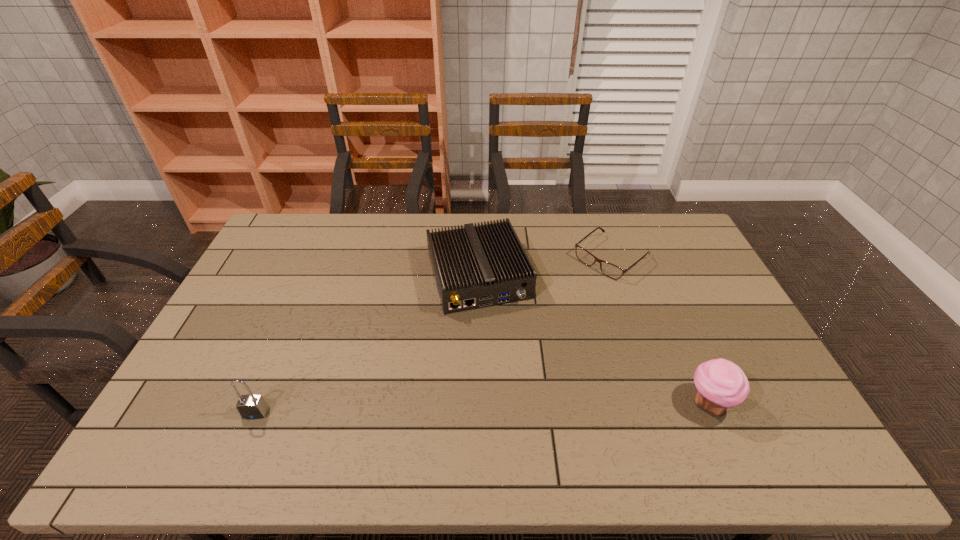
Find the location of `free spot at the left edge of the desktop`. free spot at the left edge of the desktop is located at coordinates (249, 341).

Identify the location of free space between the second object from left to right and the shortest object. (x=545, y=267).

You are a GUI agent. You are given a task and a screenshot of the screen. Output one action in this format:
    pyautogui.click(x=<x>, y=<y>)
    Task: Click on the empty location between the spectacles and the leftmost object
    The image size is (960, 540).
    Given the screenshot: What is the action you would take?
    pyautogui.click(x=434, y=335)

Where is `free point between the second object from left to right and the shortest object`? This screenshot has width=960, height=540. free point between the second object from left to right and the shortest object is located at coordinates (545, 267).

Identify the location of free space between the shortest object and the router. The width and height of the screenshot is (960, 540). (545, 267).

Identify the location of vacant area between the cupcake and the second object from left to right. (593, 340).

Find the location of a particular element. Image resolution: width=960 pixels, height=540 pixels. free space between the second object from left to right and the leftmost object is located at coordinates click(367, 345).

This screenshot has height=540, width=960. Identify the location of free space that is in between the cupcake and the spectacles. (660, 330).

I want to click on free space between the shortest object and the leftmost object, so click(x=434, y=335).

Identify the location of empty space that is in between the cupcake and the router. (593, 340).